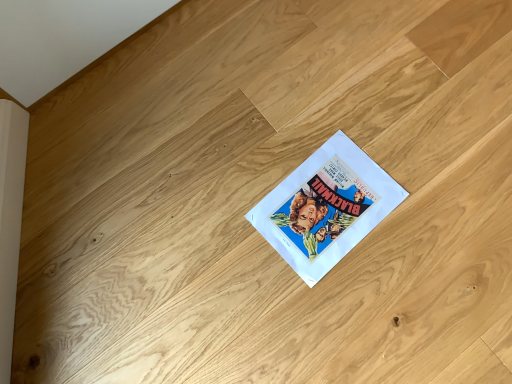
Where is `vacant area to the right of white paper at center`? vacant area to the right of white paper at center is located at coordinates (430, 196).